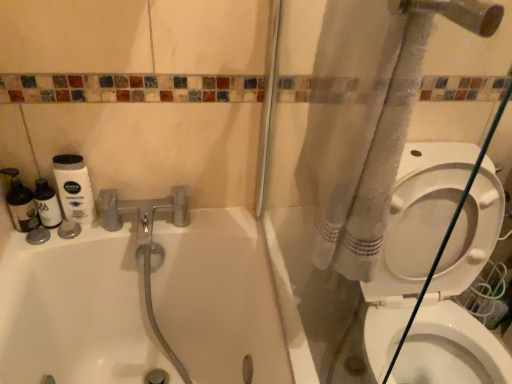
Question: Can you confirm if white fabric shower curtain at right is smaller than white glossy bidet at lower right?

Choices:
 (A) no
 (B) yes

Answer: (A)

Question: From a real-world perspective, is white fabric shower curtain at right beneath white glossy bidet at lower right?

Choices:
 (A) yes
 (B) no

Answer: (B)

Question: Would you say white fabric shower curtain at right is a long distance from white glossy bidet at lower right?

Choices:
 (A) no
 (B) yes

Answer: (A)

Question: Considering the relative sizes of white fabric shower curtain at right and white glossy bidet at lower right in the image provided, is white fabric shower curtain at right bigger than white glossy bidet at lower right?

Choices:
 (A) no
 (B) yes

Answer: (B)

Question: Is white fabric shower curtain at right to the right of white glossy bidet at lower right from the viewer's perspective?

Choices:
 (A) yes
 (B) no

Answer: (B)

Question: Could you tell me if white fabric shower curtain at right is turned towards white glossy bidet at lower right?

Choices:
 (A) no
 (B) yes

Answer: (A)

Question: Is white glossy bathtub at upper left looking in the opposite direction of white fabric shower curtain at right?

Choices:
 (A) yes
 (B) no

Answer: (B)

Question: Is there a large distance between white glossy bathtub at upper left and white fabric shower curtain at right?

Choices:
 (A) no
 (B) yes

Answer: (A)

Question: Considering the relative sizes of white glossy bathtub at upper left and white fabric shower curtain at right in the image provided, is white glossy bathtub at upper left shorter than white fabric shower curtain at right?

Choices:
 (A) no
 (B) yes

Answer: (B)

Question: Would you say white glossy bathtub at upper left contains white fabric shower curtain at right?

Choices:
 (A) yes
 (B) no

Answer: (B)

Question: Is white glossy bathtub at upper left with white fabric shower curtain at right?

Choices:
 (A) no
 (B) yes

Answer: (A)

Question: Does white glossy bathtub at upper left have a lesser width compared to white fabric shower curtain at right?

Choices:
 (A) yes
 (B) no

Answer: (B)

Question: From a real-world perspective, is white fabric shower curtain at right below white glossy bathtub at upper left?

Choices:
 (A) yes
 (B) no

Answer: (B)